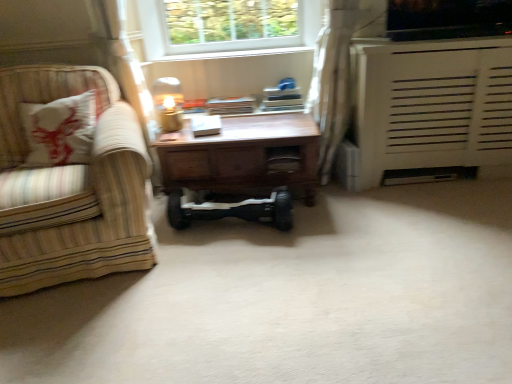
The image size is (512, 384). What are the coordinates of `vacant area situated below black rubber hoverboard at center (from a real-world perspective)` in the screenshot? It's located at pyautogui.click(x=230, y=226).